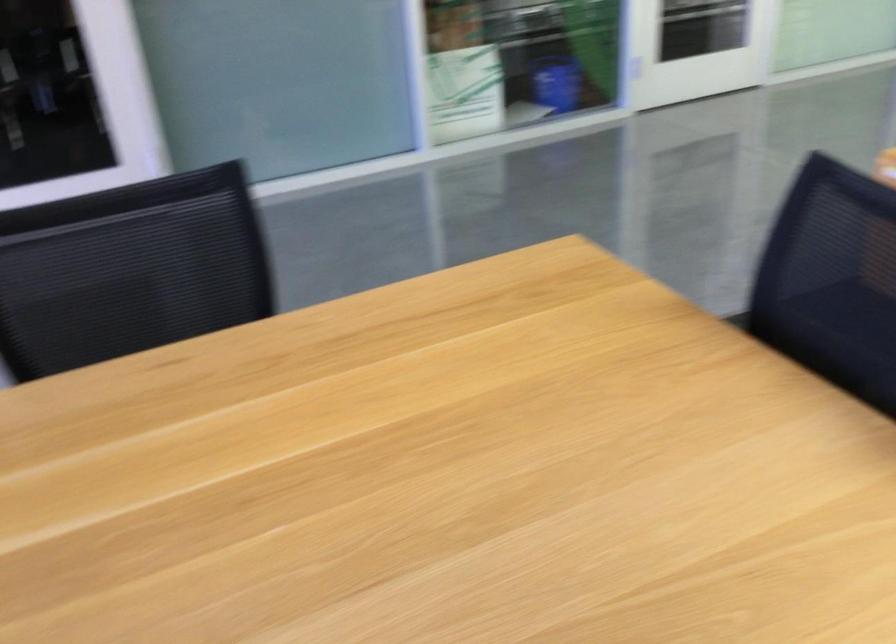
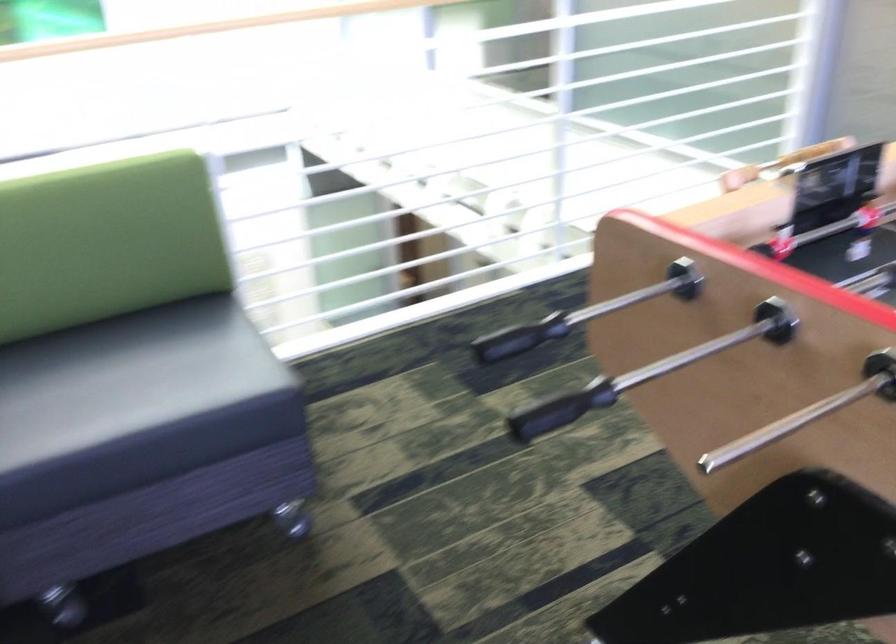
First-person continuous shooting, in which direction is the camera rotating?

The rotation direction of the camera is right-down.